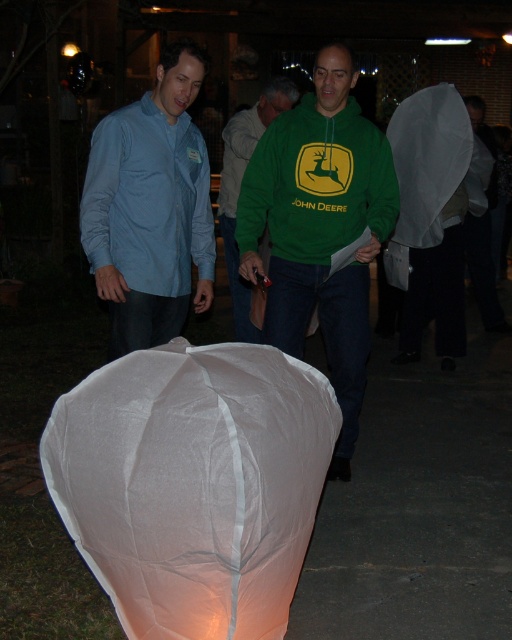
Does green fleece at center appear on the left side of green matte hoodie at center?

No, green fleece at center is not to the left of green matte hoodie at center.

Who is more distant from viewer, (308, 243) or (219, 212)?

The point (219, 212) is behind.

I want to click on green fleece at center, so click(321, 228).

Between white paper lantern at center and matte blue shirt at left, which one is positioned lower?

white paper lantern at center is below.

Between point (195, 493) and point (177, 125), which one is positioned in front?

Positioned in front is point (195, 493).

The width and height of the screenshot is (512, 640). What do you see at coordinates (194, 483) in the screenshot?
I see `white paper lantern at center` at bounding box center [194, 483].

The width and height of the screenshot is (512, 640). Find the location of `white paper lantern at center`. white paper lantern at center is located at coordinates (194, 483).

Does green fleece at center appear over matte blue shirt at left?

Incorrect, green fleece at center is not positioned above matte blue shirt at left.

Who is positioned more to the right, green fleece at center or matte blue shirt at left?

green fleece at center is more to the right.

This screenshot has width=512, height=640. I want to click on green fleece at center, so click(321, 228).

Locate an element on the screen. The image size is (512, 640). green fleece at center is located at coordinates (321, 228).